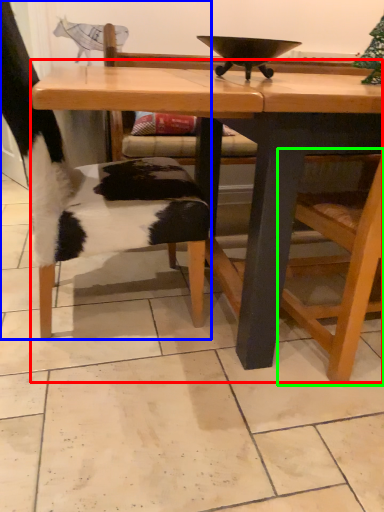
Question: Estimate the real-world distances between objects in this image. Which object is closer to table (highlighted by a red box), chair (highlighted by a blue box) or armchair (highlighted by a green box)?

Choices:
 (A) chair
 (B) armchair

Answer: (B)